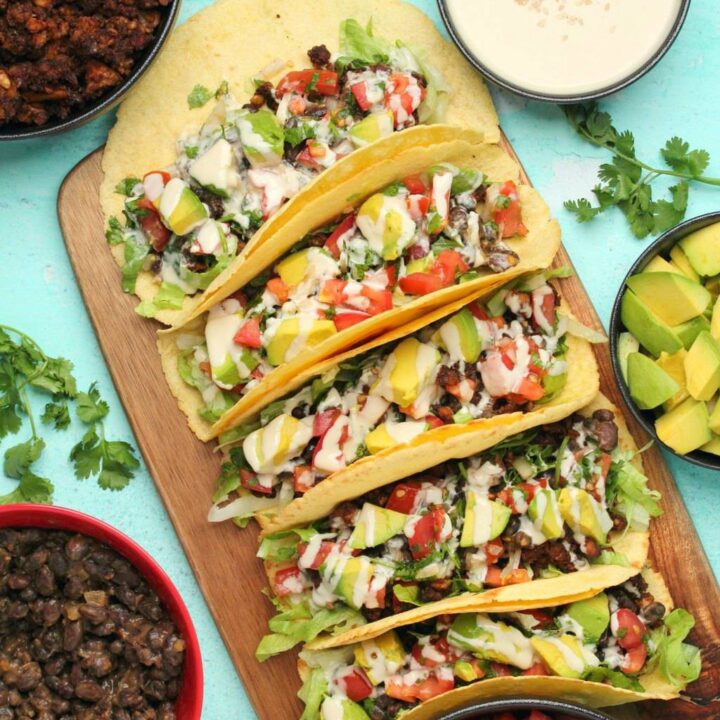
You are a GUI agent. You are given a task and a screenshot of the screen. Output one action in this format:
    pyautogui.click(x=<x>, y=<y>)
    Task: Click on the black bowl
    The image size is (720, 720).
    Given the screenshot: What is the action you would take?
    pyautogui.click(x=656, y=243), pyautogui.click(x=564, y=96), pyautogui.click(x=127, y=83), pyautogui.click(x=528, y=701)